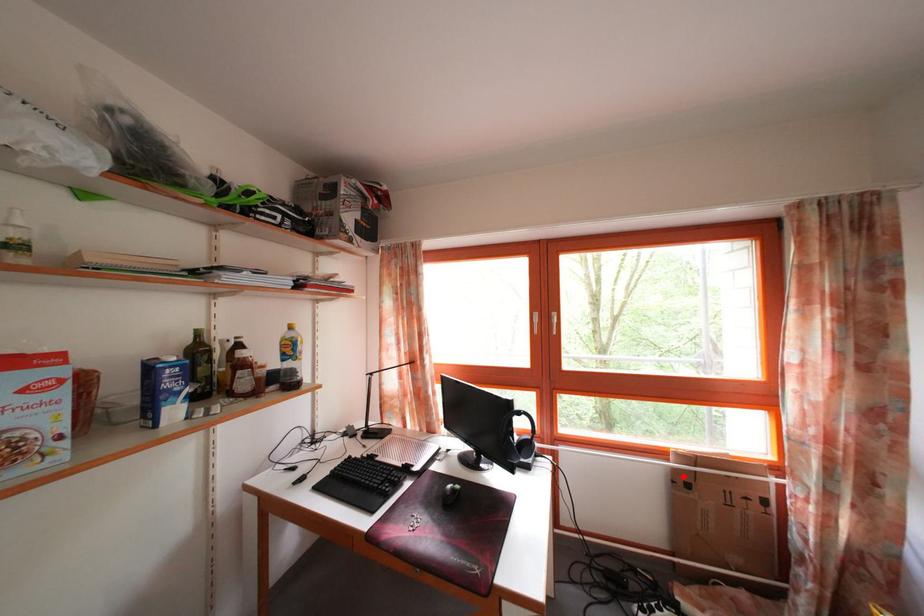
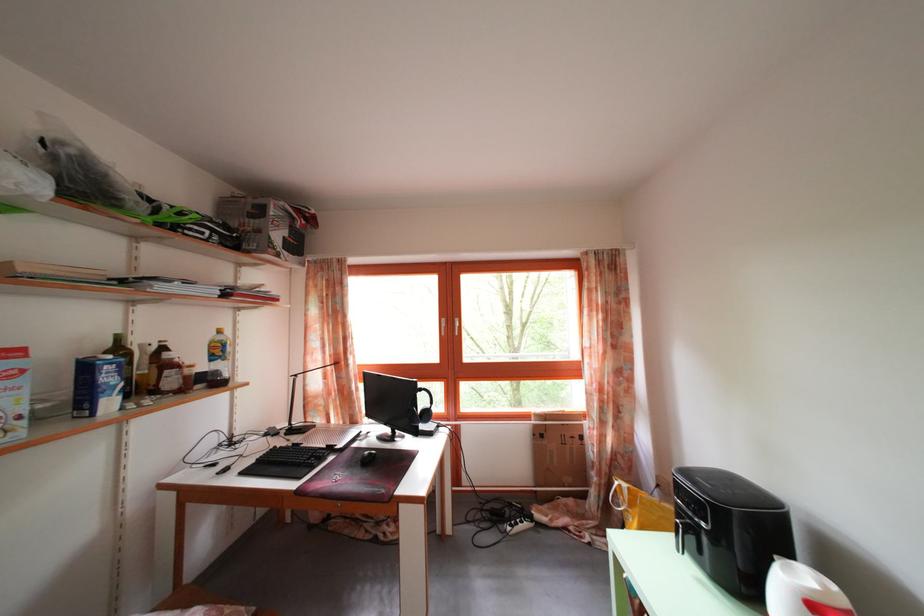
In the second image, find the point that corresponds to the highlighted location in the first image.

(542, 432)